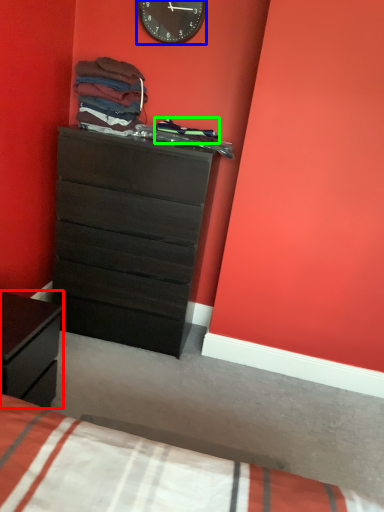
Question: Which object is positioned farthest from nightstand (highlighted by a red box)? Select from wall clock (highlighted by a blue box) and clothing (highlighted by a green box).

Choices:
 (A) wall clock
 (B) clothing

Answer: (A)